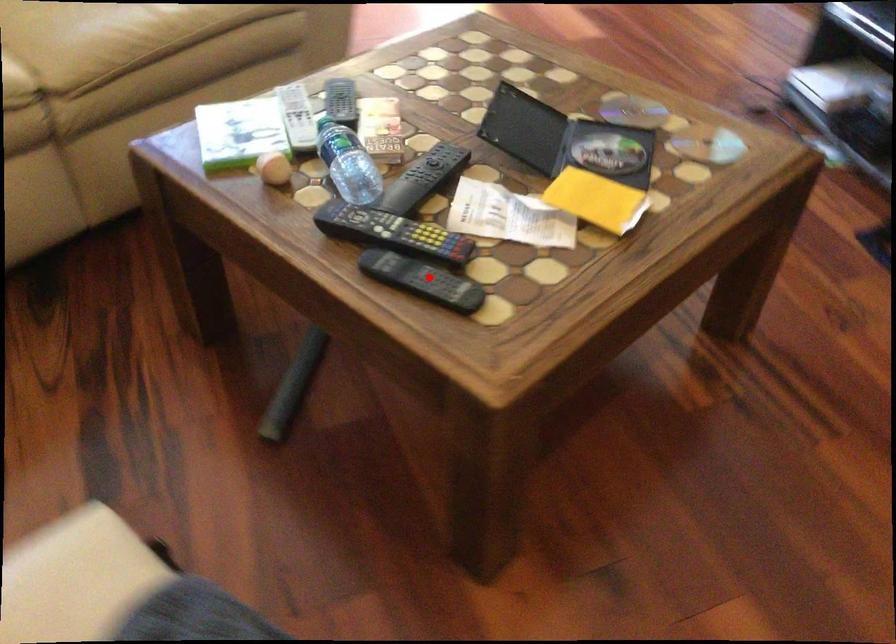
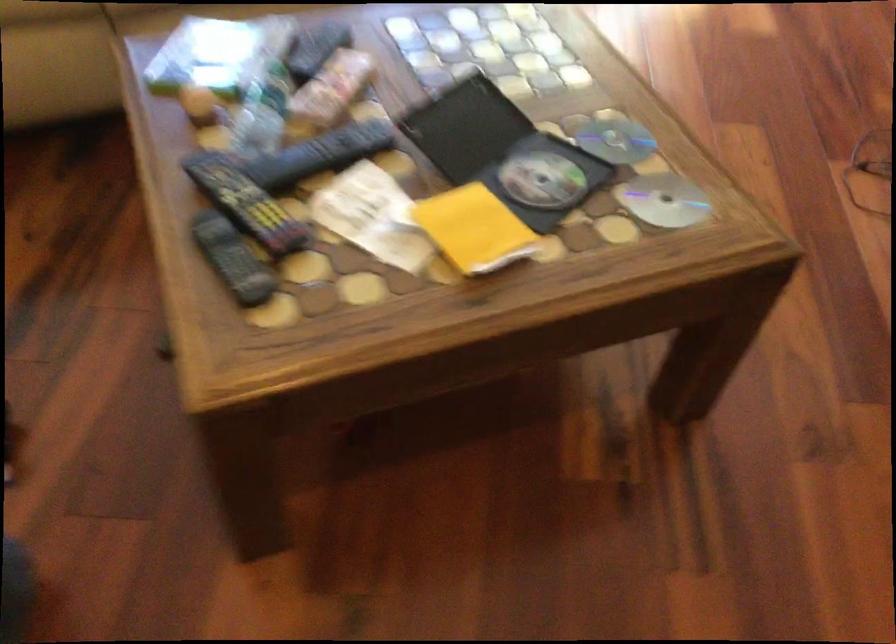
The point at the highlighted location is marked in the first image. Where is the corresponding point in the second image?

(233, 259)